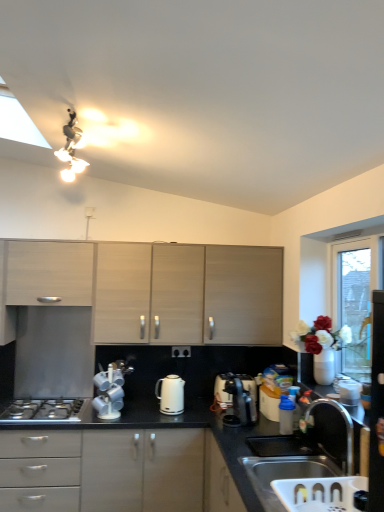
Find the location of `vacant space to the left of white glossy electric kettle at center`. vacant space to the left of white glossy electric kettle at center is located at coordinates (140, 411).